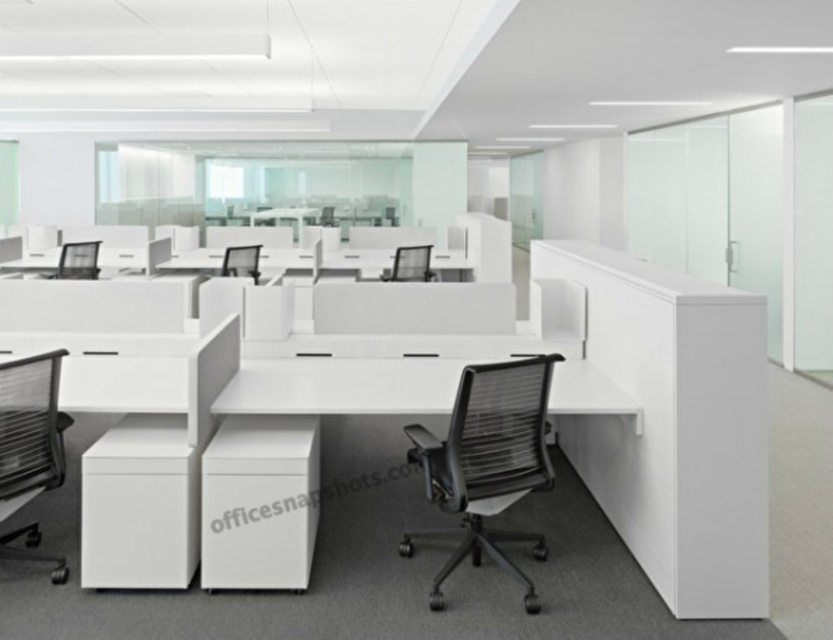
You are an office worker who needs to adjust the height of your desk to be level with your chair. The white matte desk at center and the black mesh swivel chair at left are in your workspace. Based on their current heights, which one should you adjust and in what direction?

The white matte desk at center is not as tall as the black mesh swivel chair at left, so you should raise the desk to match the chair height.

You are an office worker who needs to move from your desk to a meeting room located 5 meters away. You see the black mesh swivel chair at left and the black mesh chair at center in your path. Will you be able to walk through the space between them without any obstacles?

The black mesh swivel chair at left and the black mesh chair at center are 4.24 meters apart from each other. Since the distance between them is less than the 5 meters required to reach the meeting room, you will need to navigate around them or find an alternative path.